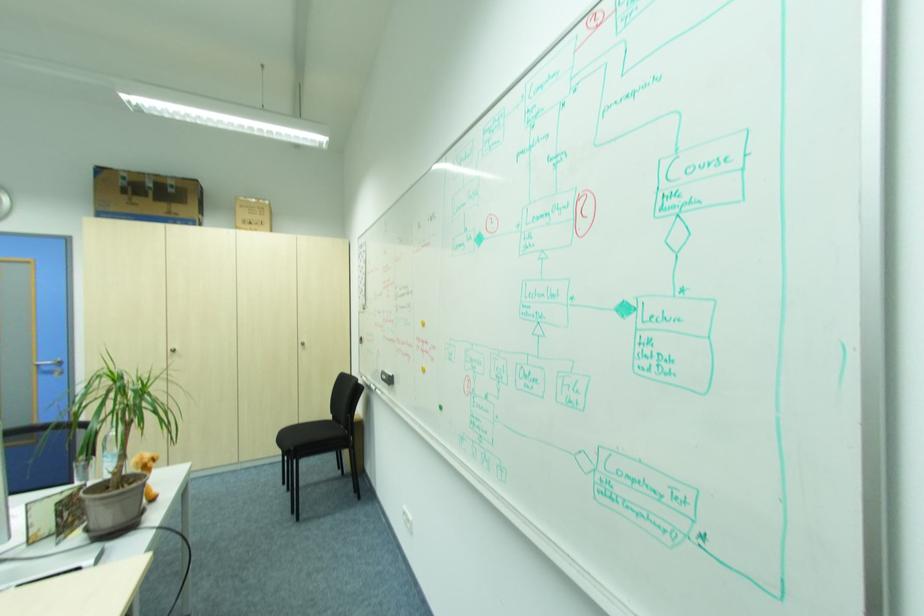
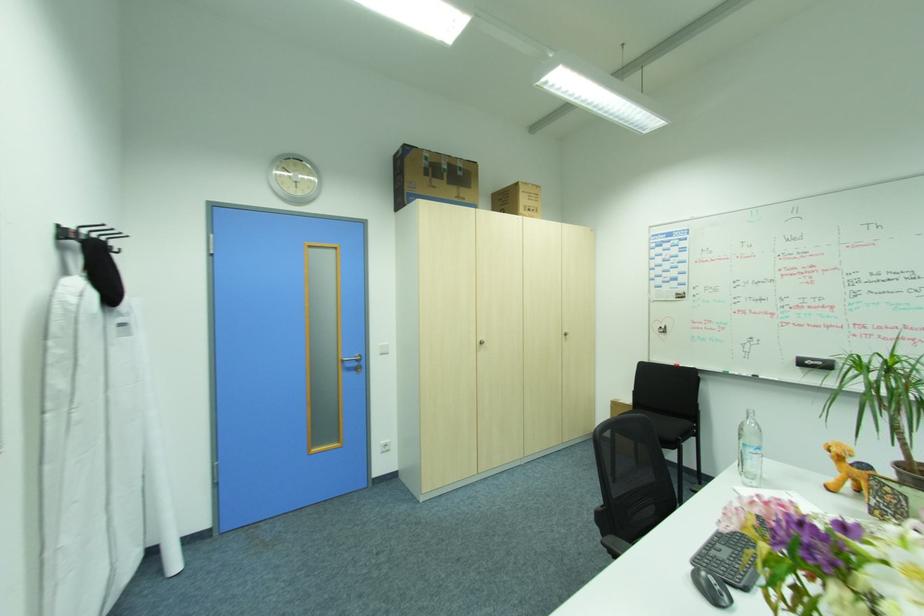
Question: The images are taken continuously from a first-person perspective. In which direction are you moving?

Choices:
 (A) Left
 (B) Right
 (C) Forward
 (D) Backward

Answer: (A)